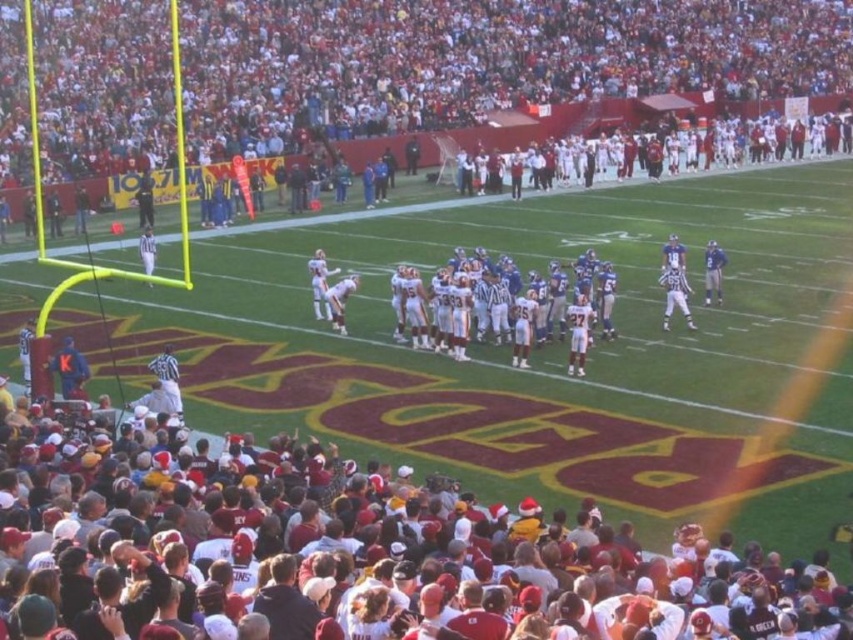
You are a photographer trying to capture the most representative photo of the home team supporters. Given the maroon fabric crowd at lower center and the red fabric crowd at upper center, which crowd section should you focus on to show the larger group of fans?

The red fabric crowd at upper center should be focused on because it occupies more space than the maroon fabric crowd at lower center, indicating a larger group of fans.

You are a photographer standing at the center of the field. You want to take a photo of the maroon fabric crowd at lower center. What are the coordinates where you should point your camera?

The coordinates to point the camera are at point [357,545].